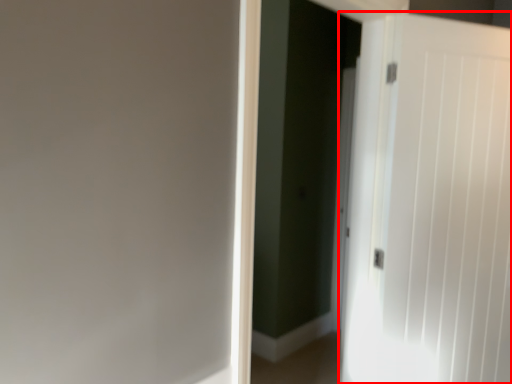
Question: Observing the image, what is the correct spatial positioning of door (annotated by the red box) in reference to screen door?

Choices:
 (A) right
 (B) left

Answer: (A)